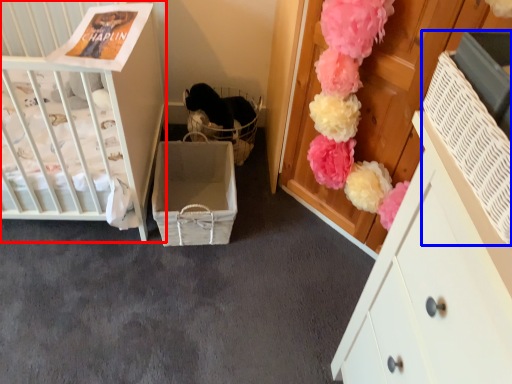
Question: Which object appears farthest to the camera in this image, infant bed (highlighted by a red box) or storage box (highlighted by a blue box)?

Choices:
 (A) infant bed
 (B) storage box

Answer: (A)